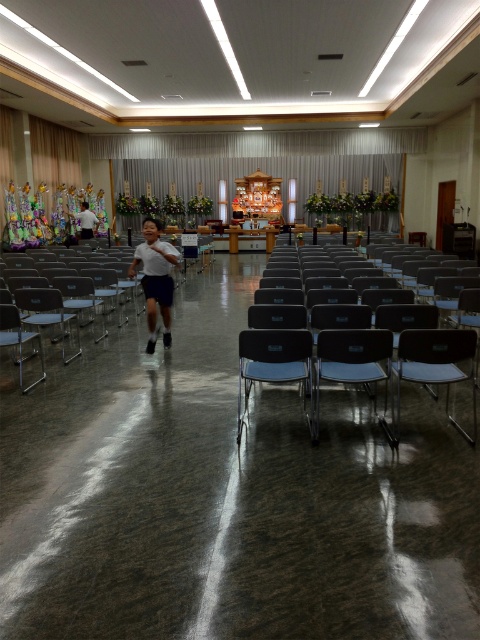
Question: Among these points, which one is farthest from the camera?

Choices:
 (A) (456, 424)
 (B) (237, 442)

Answer: (A)

Question: In this image, where is black plastic chair at center located relative to matte gray chair at center?

Choices:
 (A) above
 (B) below

Answer: (A)

Question: Does matte gray chair at center have a lesser width compared to white matte shirt at left?

Choices:
 (A) no
 (B) yes

Answer: (A)

Question: From the image, what is the correct spatial relationship of matte gray chair at center in relation to white matte shirt at left?

Choices:
 (A) above
 (B) below

Answer: (B)

Question: Which object is positioned farthest from the black plastic chair at center?

Choices:
 (A) metallic blue chair at center
 (B) white matte shirt at left
 (C) matte plastic chair at center

Answer: (B)

Question: Which object is positioned closest to the matte gray chair at center?

Choices:
 (A) matte plastic chair at center
 (B) metallic blue chair at center

Answer: (A)